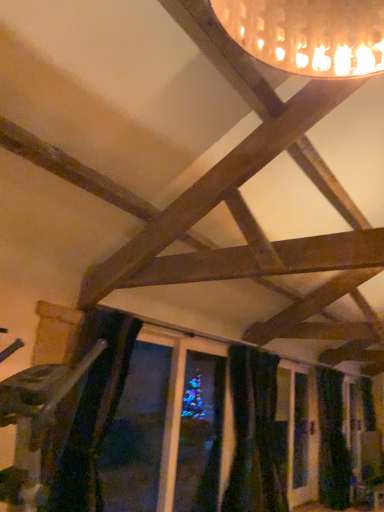
Question: Choose the correct answer: Is black velvet curtain at lower center, placed as the 1th curtain when sorted from front to back, inside dark blue velvet curtain at lower right, positioned as the first curtain in back-to-front order, or outside it?

Choices:
 (A) inside
 (B) outside

Answer: (B)

Question: Considering the positions of point (238, 419) and point (319, 422), is point (238, 419) closer or farther from the camera than point (319, 422)?

Choices:
 (A) closer
 (B) farther

Answer: (A)

Question: From the image's perspective, relative to dark blue velvet curtain at lower right, which is counted as the 2th curtain, starting from the front, is black velvet curtain at lower center, the second curtain viewed from the right, above or below?

Choices:
 (A) below
 (B) above

Answer: (B)

Question: Considering their positions, is dark blue velvet curtain at lower right, which is counted as the 2th curtain, starting from the front, located in front of or behind black velvet curtain at lower center, placed as the 1th curtain when sorted from left to right?

Choices:
 (A) behind
 (B) front

Answer: (A)

Question: From a real-world perspective, is dark blue velvet curtain at lower right, positioned as the second curtain in left-to-right order, physically located above or below black velvet curtain at lower center, placed as the 1th curtain when sorted from front to back?

Choices:
 (A) above
 (B) below

Answer: (B)

Question: Is point (322, 431) positioned closer to the camera than point (276, 443)?

Choices:
 (A) closer
 (B) farther

Answer: (B)

Question: From the image's perspective, is dark blue velvet curtain at lower right, which is counted as the 2th curtain, starting from the front, above or below black velvet curtain at lower center, which is the second curtain from back to front?

Choices:
 (A) below
 (B) above

Answer: (A)